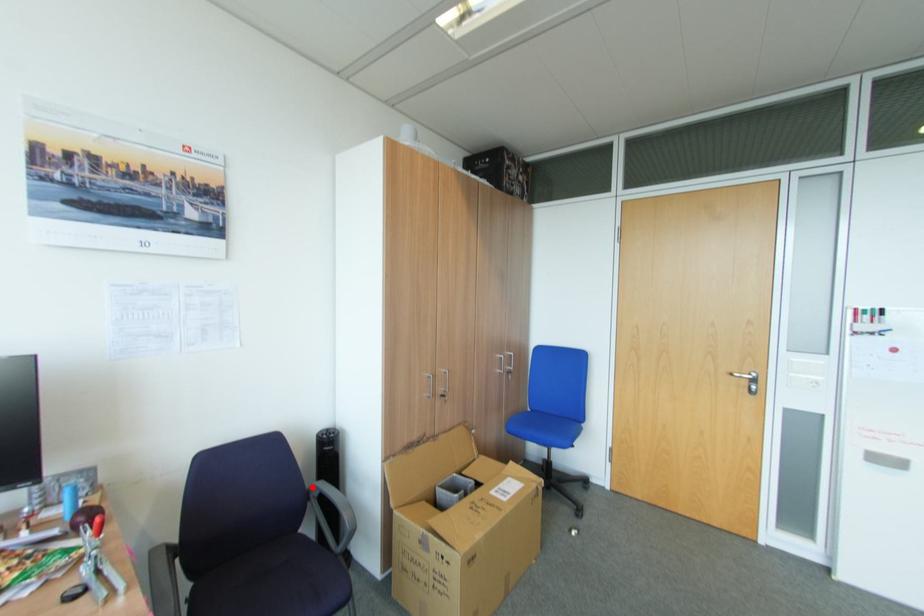
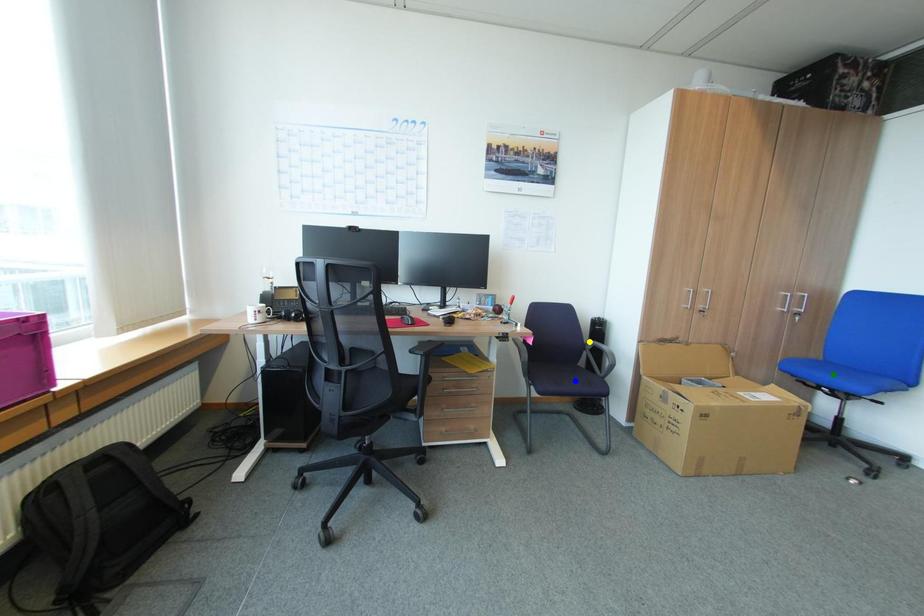
Question: I am providing you with two images of the same scene from different viewpoints. A red point is marked on the first image. You are given multiple points on the second image. Which mark in image 2 goes with the point in image 1?

Choices:
 (A) blue point
 (B) yellow point
 (C) green point

Answer: (B)